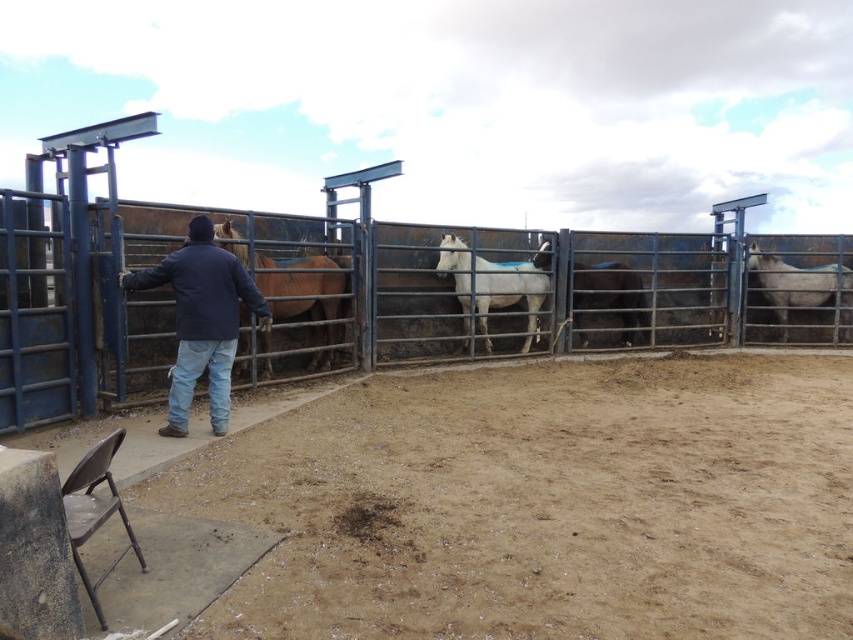
You are standing outside the pen and want to see the brown matte horse at center clearly. Can you see it without any obstructions from the rusty metal fence at center?

Yes, because the rusty metal fence at center is in front of the brown matte horse at center, but since you are outside the pen, you can see through the fence and view the horse clearly.

You are a farmer standing outside the pen. You want to check the height of the dark blue jacket at center compared to the brown matte horse at center. Based on the scene, which one is taller?

The dark blue jacket at center is much taller than the brown matte horse at center.

In the scene shown: You are standing in front of the metal pen at the farm. There are two points marked inside the pen. Which point is closer to you, point (x=219, y=227) or point (x=585, y=298)?

Point (x=219, y=227) is closer to the viewer than point (x=585, y=298).